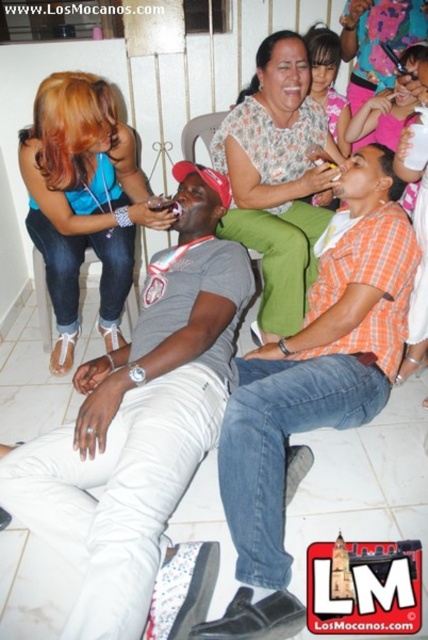
You are organizing a clothing donation drive and need to sort items based on size. You have two shirts here, the orange plaid shirt at center and the matte blue tank top at upper left. Which shirt should you place in the large size bin?

The orange plaid shirt at center is bigger than the matte blue tank top at upper left, so you should place the orange plaid shirt at center in the large size bin.

You are a photographer trying to capture a group photo of the matte blue tank top at upper left and the smooth skin face at upper center. If your camera can only focus on objects within a 20 cm width, will both fit in the frame?

The matte blue tank top at upper left might be wider than smooth skin face at upper center, so it is uncertain if both will fit within the 20 cm width. The photographer should check the combined width of both objects to ensure they fit.